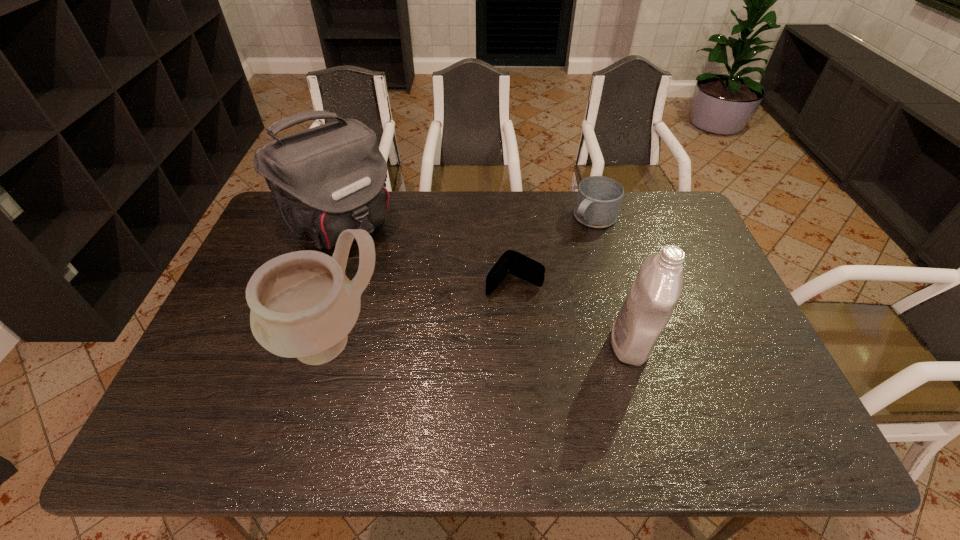
Locate an element on the screen. object positioned at the left edge is located at coordinates (323, 180).

Identify the location of object present at the far left corner. This screenshot has width=960, height=540. (323, 180).

Identify the location of vacant space at the far edge. (443, 217).

Locate an element on the screen. free space at the near edge of the desktop is located at coordinates (578, 393).

The height and width of the screenshot is (540, 960). I want to click on free space at the far right corner, so click(x=652, y=192).

Locate an element on the screen. This screenshot has width=960, height=540. free spot between the pottery and the second shortest object is located at coordinates (463, 280).

The image size is (960, 540). Find the location of `free spot between the detergent and the pottery`. free spot between the detergent and the pottery is located at coordinates (481, 342).

Locate an element on the screen. The image size is (960, 540). unoccupied area between the shoulder bag and the detergent is located at coordinates (486, 284).

Find the location of a particular element. The image size is (960, 540). unoccupied area between the shoulder bag and the third object from left to right is located at coordinates (427, 254).

Find the location of a particular element. Image resolution: width=960 pixels, height=540 pixels. free space between the third object from right to left and the detergent is located at coordinates (572, 314).